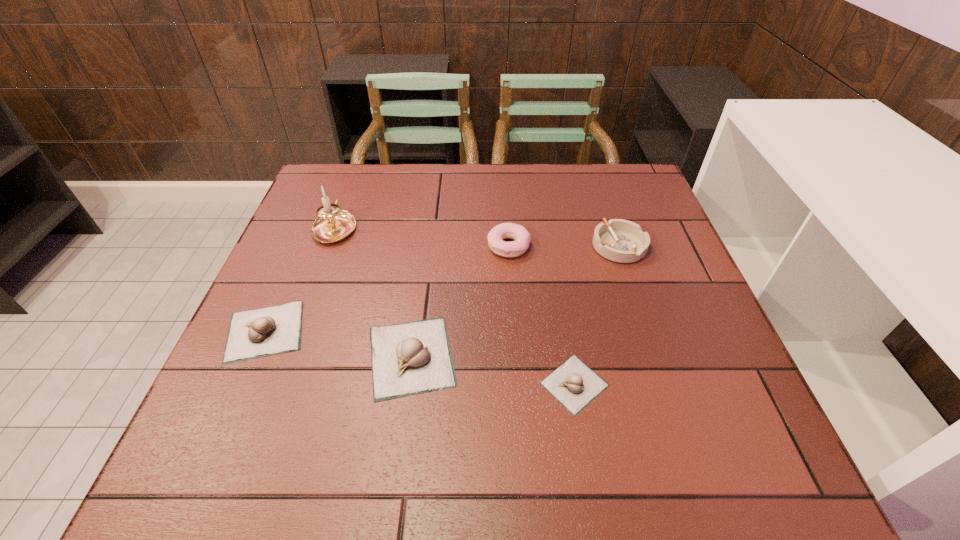
Identify the location of free location at the right edge of the desktop. (636, 280).

Locate an element on the screen. The height and width of the screenshot is (540, 960). free space at the far left corner is located at coordinates (362, 185).

Locate an element on the screen. The height and width of the screenshot is (540, 960). vacant space at the near left corner is located at coordinates (247, 393).

The width and height of the screenshot is (960, 540). What are the coordinates of `free space at the far right corner` in the screenshot? It's located at (629, 183).

I want to click on free space at the near right corner, so click(659, 380).

The width and height of the screenshot is (960, 540). What are the coordinates of `vacant area that lies between the second shortest garlic and the doughnut` in the screenshot? It's located at (387, 288).

Find the location of a particular element. The width and height of the screenshot is (960, 540). free space between the doughnut and the second garlic from left to right is located at coordinates (460, 301).

Where is `free spot between the ashtray and the second garlic from left to right`? Image resolution: width=960 pixels, height=540 pixels. free spot between the ashtray and the second garlic from left to right is located at coordinates (516, 301).

You are a GUI agent. You are given a task and a screenshot of the screen. Output one action in this format:
    pyautogui.click(x=<x>, y=<y>)
    Task: Click on the empty location between the doughnut and the rightmost garlic
    Image resolution: width=960 pixels, height=540 pixels.
    Given the screenshot: What is the action you would take?
    pyautogui.click(x=541, y=315)

The height and width of the screenshot is (540, 960). Find the location of `vacant area between the doughnut and the rightmost object`. vacant area between the doughnut and the rightmost object is located at coordinates (564, 246).